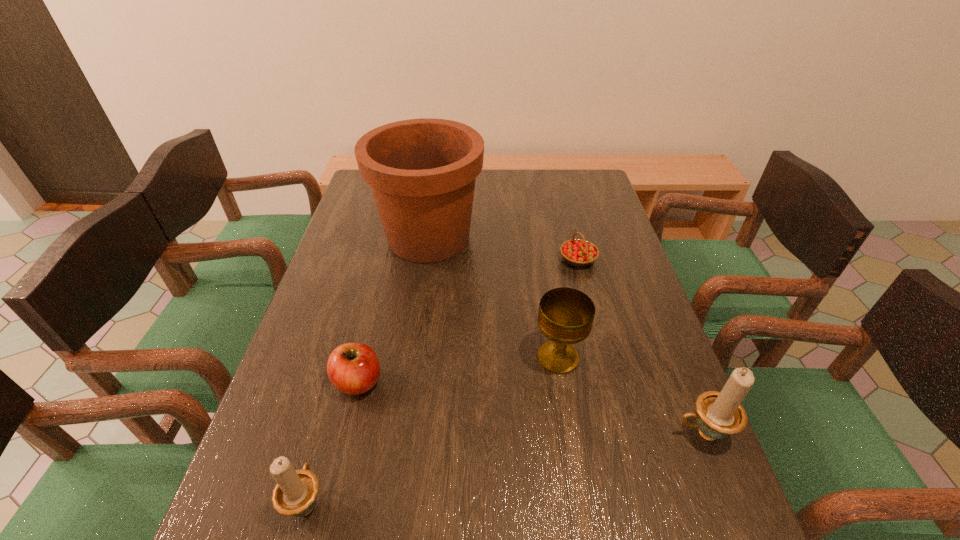
Locate an element on the screen. This screenshot has height=540, width=960. the left candle_holder is located at coordinates (295, 494).

Where is `the shorter candle_holder`? This screenshot has width=960, height=540. the shorter candle_holder is located at coordinates (295, 494).

This screenshot has height=540, width=960. Identify the location of the second tallest object. (719, 414).

Locate an element on the screen. the rightmost object is located at coordinates (719, 414).

What are the coordinates of `strawberry` in the screenshot? It's located at (578, 252).

Locate an element on the screen. This screenshot has width=960, height=540. flowerpot is located at coordinates (422, 172).

Find the location of `apple`. apple is located at coordinates (353, 368).

Locate an element on the screen. The height and width of the screenshot is (540, 960). chalice is located at coordinates (566, 315).

Locate an element on the screen. free region located on the handle side of the nearest object is located at coordinates (348, 355).

At what (x,y) coordinates should I click in order to perform the action: click on free region located 0.370m on the handle side of the nearest object. Please return your answer as a coordinate pair (x, y). Image resolution: width=960 pixels, height=540 pixels. Looking at the image, I should click on (355, 329).